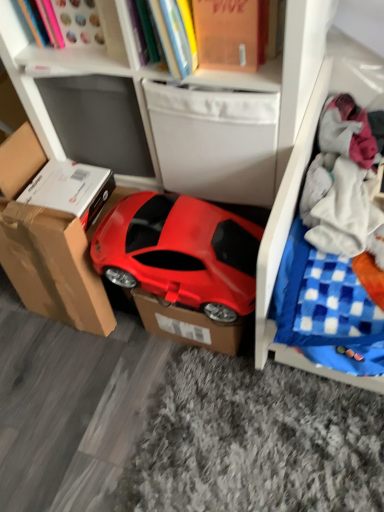
Question: Is white plastic cabinet at upper center further to the viewer compared to white soft fabric at right?

Choices:
 (A) no
 (B) yes

Answer: (A)

Question: Can you confirm if white plastic cabinet at upper center is positioned to the right of white soft fabric at right?

Choices:
 (A) yes
 (B) no

Answer: (B)

Question: Is white plastic cabinet at upper center to the left of white soft fabric at right from the viewer's perspective?

Choices:
 (A) no
 (B) yes

Answer: (B)

Question: From a real-world perspective, is white plastic cabinet at upper center physically below white soft fabric at right?

Choices:
 (A) no
 (B) yes

Answer: (A)

Question: Is white plastic cabinet at upper center touching white soft fabric at right?

Choices:
 (A) yes
 (B) no

Answer: (B)

Question: Considering their positions, is orange matte book at upper center located in front of or behind matte cardboard box at center, the first cardboard box viewed from the right?

Choices:
 (A) front
 (B) behind

Answer: (A)

Question: Considering the positions of point (173, 66) and point (139, 311), is point (173, 66) closer or farther from the camera than point (139, 311)?

Choices:
 (A) closer
 (B) farther

Answer: (A)

Question: In terms of width, does orange matte book at upper center look wider or thinner when compared to matte cardboard box at center, the first cardboard box viewed from the right?

Choices:
 (A) wide
 (B) thin

Answer: (A)

Question: Would you say orange matte book at upper center is to the left or to the right of matte cardboard box at center, the second cardboard box from the left, in the picture?

Choices:
 (A) left
 (B) right

Answer: (B)

Question: Based on their sizes in the image, would you say matte cardboard box at center, the second cardboard box from the left, is bigger or smaller than matte plastic car at center?

Choices:
 (A) small
 (B) big

Answer: (A)

Question: From the image's perspective, is matte cardboard box at center, the first cardboard box viewed from the right, located above or below matte plastic car at center?

Choices:
 (A) above
 (B) below

Answer: (B)

Question: Is matte cardboard box at center, the second cardboard box from the left, spatially inside matte plastic car at center, or outside of it?

Choices:
 (A) outside
 (B) inside

Answer: (A)

Question: From a real-world perspective, relative to matte plastic car at center, is matte cardboard box at center, the second cardboard box from the left, vertically above or below?

Choices:
 (A) below
 (B) above

Answer: (A)

Question: Would you say matte white bookcase at upper center is inside or outside orange matte book at upper center?

Choices:
 (A) outside
 (B) inside

Answer: (A)

Question: Considering the positions of matte white bookcase at upper center and orange matte book at upper center in the image, is matte white bookcase at upper center taller or shorter than orange matte book at upper center?

Choices:
 (A) tall
 (B) short

Answer: (A)